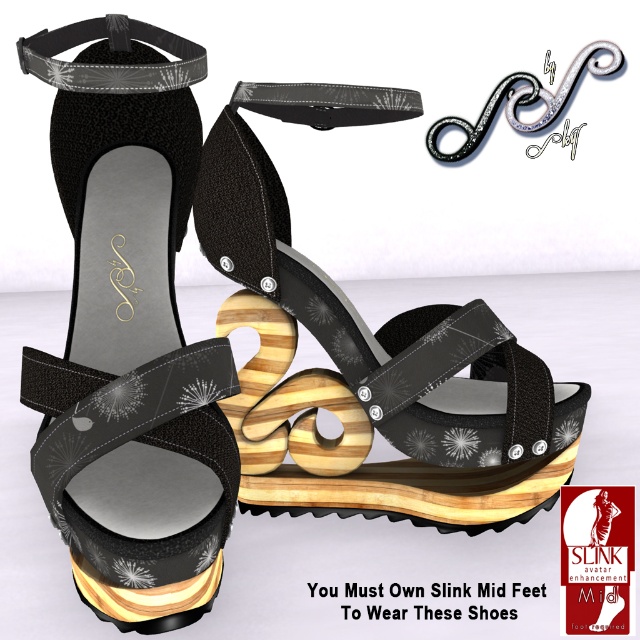
Question: Estimate the real-world distances between objects in this image. Which object is closer to the silver metallic strap at upper center?

Choices:
 (A) black leather strap at upper center
 (B) wooden platform sandal at center
 (C) matte black leather sandal at center

Answer: (B)

Question: Considering the real-world distances, which object is farthest from the silver metallic strap at upper center?

Choices:
 (A) wooden platform sandal at center
 (B) matte black leather sandal at center
 (C) black leather strap at upper center

Answer: (C)

Question: Is wooden platform sandal at center below black leather strap at upper center?

Choices:
 (A) no
 (B) yes

Answer: (B)

Question: Considering the relative positions of black leather strap at upper center and silver metallic strap at upper center in the image provided, where is black leather strap at upper center located with respect to silver metallic strap at upper center?

Choices:
 (A) left
 (B) right

Answer: (A)

Question: Which of the following is the farthest from the observer?

Choices:
 (A) 179,241
 (B) 173,38
 (C) 516,125

Answer: (C)

Question: Is wooden platform sandal at center wider than black leather strap at upper center?

Choices:
 (A) yes
 (B) no

Answer: (A)